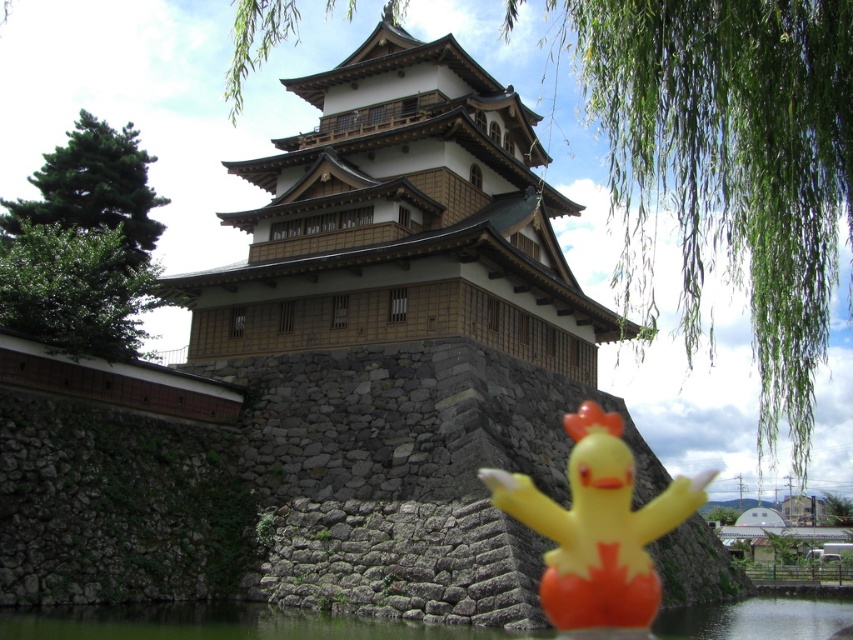
You are a visitor standing in front of the traditional Japanese castle and see the yellow rubber duck at center and the transparent water at lower center. Which object is closer to you?

The yellow rubber duck at center is closer to you because the transparent water at lower center is behind it.

You are a drone operator who needs to capture a photo of the yellow rubber duck at center from directly above. Based on the castle structure and the duck location, can you confirm if there are any obstructions between the drone and the duck?

The yellow rubber duck at center is located at point (598, 531). Since the castle structure is behind the duck in the image, there should be no obstructions between the drone and the duck when approaching from above.

You are standing in front of the traditional Japanese castle and want to determine the relative positions of two points marked on the image. Which point, point (659, 589) or point (764, 604), is closer to you?

Point (659, 589) is closer to the viewer than point (764, 604).